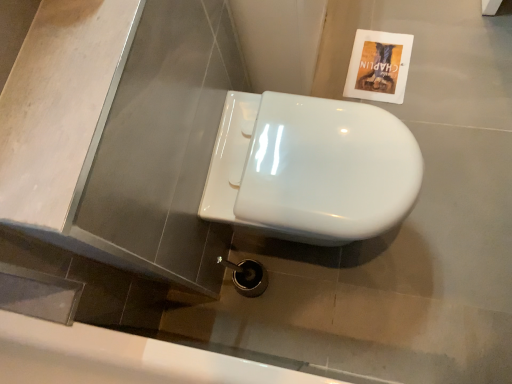
What do you see at coordinates (120, 358) in the screenshot? I see `white glossy bath at lower center` at bounding box center [120, 358].

What do you see at coordinates (379, 66) in the screenshot? This screenshot has width=512, height=384. I see `matte paper flyer at upper right` at bounding box center [379, 66].

The height and width of the screenshot is (384, 512). In order to click on white glossy toilet at center in this screenshot , I will do `click(310, 168)`.

From the image's perspective, which one is positioned higher, matte paper flyer at upper right or white glossy toilet at center?

matte paper flyer at upper right is shown above in the image.

Is matte paper flyer at upper right in contact with white glossy toilet at center?

There is a gap between matte paper flyer at upper right and white glossy toilet at center.

Visually, is matte paper flyer at upper right positioned to the left or to the right of white glossy toilet at center?

Based on their positions, matte paper flyer at upper right is located to the right of white glossy toilet at center.

Based on the photo, who is shorter, white glossy toilet at center or matte paper flyer at upper right?

Answer: Standing shorter between the two is matte paper flyer at upper right.

Is white glossy toilet at center not close to matte paper flyer at upper right?

No, white glossy toilet at center is in close proximity to matte paper flyer at upper right.

From a real-world perspective, which object rests below the other?

matte paper flyer at upper right is physically lower.

Could you tell me if white glossy bath at lower center is turned towards matte paper flyer at upper right?

No, white glossy bath at lower center is not oriented towards matte paper flyer at upper right.

From the image's perspective, is white glossy bath at lower center positioned above or below matte paper flyer at upper right?

Based on their image positions, white glossy bath at lower center is located beneath matte paper flyer at upper right.

Based on the photo, considering the positions of objects white glossy bath at lower center and matte paper flyer at upper right in the image provided, who is more to the left, white glossy bath at lower center or matte paper flyer at upper right?

From the viewer's perspective, white glossy bath at lower center appears more on the left side.

Considering the positions of objects white glossy bath at lower center and white glossy toilet at center in the image provided, who is more to the right, white glossy bath at lower center or white glossy toilet at center?

white glossy toilet at center is more to the right.

Can we say white glossy bath at lower center lies outside white glossy toilet at center?

Yes, white glossy bath at lower center is outside of white glossy toilet at center.

Which of these two, white glossy bath at lower center or white glossy toilet at center, is bigger?

white glossy bath at lower center is bigger.

Is white glossy bath at lower center further to camera compared to white glossy toilet at center?

No, white glossy bath at lower center is in front of white glossy toilet at center.

There is a white glossy toilet at center. At what (x,y) coordinates should I click in order to perform the action: click on bath above it (from a real-world perspective). Please return your answer as a coordinate pair (x, y). This screenshot has width=512, height=384. Looking at the image, I should click on (120, 358).

Looking at their sizes, would you say white glossy toilet at center is wider or thinner than white glossy bath at lower center?

In the image, white glossy toilet at center appears to be more narrow than white glossy bath at lower center.

From the image's perspective, is white glossy toilet at center located above white glossy bath at lower center?

Correct, white glossy toilet at center appears higher than white glossy bath at lower center in the image.

From the image's perspective, is matte paper flyer at upper right under white glossy bath at lower center?

No, from the image's perspective, matte paper flyer at upper right is not beneath white glossy bath at lower center.

Is matte paper flyer at upper right turned away from white glossy bath at lower center?

Correct, matte paper flyer at upper right is looking away from white glossy bath at lower center.

Based on the photo, is matte paper flyer at upper right thinner than white glossy bath at lower center?

Yes, matte paper flyer at upper right is thinner than white glossy bath at lower center.

From a real-world perspective, is matte paper flyer at upper right positioned above or below white glossy bath at lower center?

In terms of real-world spatial position, matte paper flyer at upper right is below white glossy bath at lower center.

Image resolution: width=512 pixels, height=384 pixels. What are the coordinates of `toilet in front of the matte paper flyer at upper right` in the screenshot? It's located at (310, 168).

In order to click on flyer below the white glossy toilet at center (from a real-world perspective) in this screenshot , I will do `click(379, 66)`.

Looking at the image, which one is located further to white glossy bath at lower center, matte paper flyer at upper right or white glossy toilet at center?

matte paper flyer at upper right is further to white glossy bath at lower center.

From the image, which object appears to be farther from white glossy toilet at center, white glossy bath at lower center or matte paper flyer at upper right?

The object further to white glossy toilet at center is matte paper flyer at upper right.

Considering their positions, is white glossy toilet at center positioned further to matte paper flyer at upper right than white glossy bath at lower center?

white glossy bath at lower center is further to matte paper flyer at upper right.

Which object lies further to the anchor point white glossy toilet at center, matte paper flyer at upper right or white glossy bath at lower center?

matte paper flyer at upper right is further to white glossy toilet at center.

Based on their spatial positions, is white glossy toilet at center or matte paper flyer at upper right closer to white glossy bath at lower center?

The object closer to white glossy bath at lower center is white glossy toilet at center.

Considering their positions, is white glossy bath at lower center positioned further to matte paper flyer at upper right than white glossy toilet at center?

The object further to matte paper flyer at upper right is white glossy bath at lower center.

I want to click on toilet between matte paper flyer at upper right and white glossy bath at lower center vertically, so click(x=310, y=168).